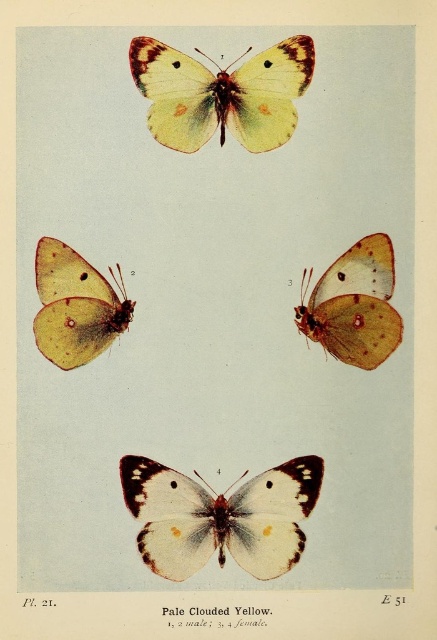
Is pale clouded yellow at center smaller than matte yellow butterfly at upper center?

Yes, pale clouded yellow at center is smaller than matte yellow butterfly at upper center.

The height and width of the screenshot is (640, 437). Find the location of `pale clouded yellow at center`. pale clouded yellow at center is located at coordinates (221, 516).

You are a GUI agent. You are given a task and a screenshot of the screen. Output one action in this format:
    pyautogui.click(x=<x>, y=<y>)
    Task: Click on the pale clouded yellow at center
    
    Given the screenshot: What is the action you would take?
    pyautogui.click(x=221, y=516)

Which is above, matte yellow butterfly at upper center or matte yellow butterfly at upper left?

matte yellow butterfly at upper center is higher up.

Does point (252, 113) come behind point (63, 262)?

No, it is in front of (63, 262).

Locate an element on the screen. The width and height of the screenshot is (437, 640). matte yellow butterfly at upper center is located at coordinates (221, 93).

Is pale clouded yellow at center thinner than matte orange butterfly at center right?

In fact, pale clouded yellow at center might be wider than matte orange butterfly at center right.

Image resolution: width=437 pixels, height=640 pixels. Describe the element at coordinates (221, 516) in the screenshot. I see `pale clouded yellow at center` at that location.

Is point (277, 506) farther from camera compared to point (378, 262)?

No, (277, 506) is in front of (378, 262).

The image size is (437, 640). I want to click on pale clouded yellow at center, so click(x=221, y=516).